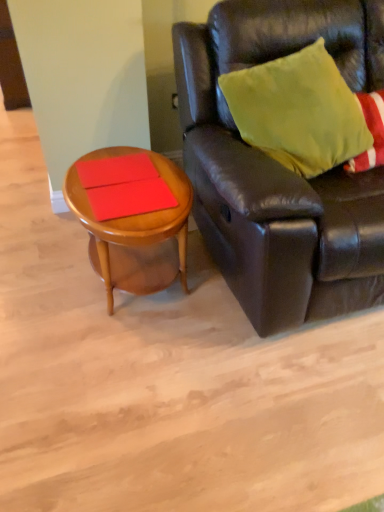
At what (x,y) coordinates should I click in order to perform the action: click on free space in front of woodenobject at left. Please return your answer as a coordinate pair (x, y). Looking at the image, I should click on (124, 374).